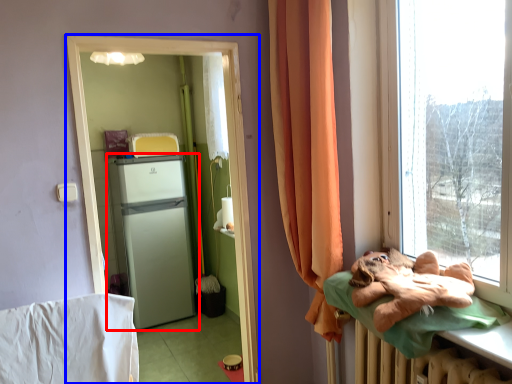
Question: Which object appears farthest to the camera in this image, refrigerator (highlighted by a red box) or screen door (highlighted by a blue box)?

Choices:
 (A) refrigerator
 (B) screen door

Answer: (A)